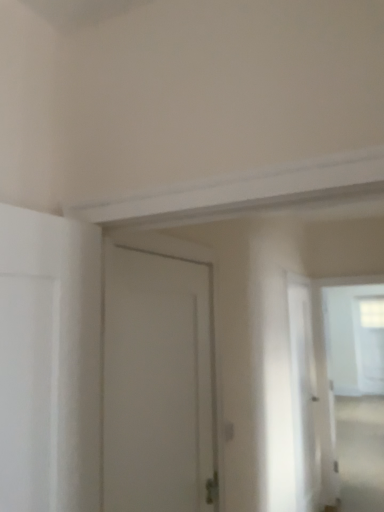
Question: From their relative heights in the image, would you say white matte door at center is taller or shorter than transparent plastic screen door at right?

Choices:
 (A) tall
 (B) short

Answer: (B)

Question: Is white matte door at center wider or thinner than transparent plastic screen door at right?

Choices:
 (A) wide
 (B) thin

Answer: (B)

Question: Based on their relative distances, which object is nearer to the transparent plastic screen door at right?

Choices:
 (A) white matte door at center
 (B) transparent glass window at upper right

Answer: (A)

Question: Which of these objects is positioned closest to the transparent plastic screen door at right?

Choices:
 (A) white matte door at center
 (B) transparent glass window at upper right

Answer: (A)